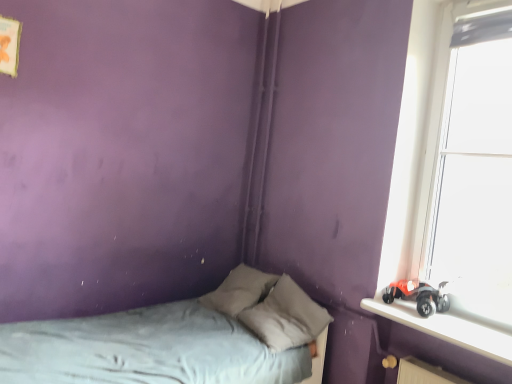
Describe the element at coordinates (458, 193) in the screenshot. I see `transparent glass window at right` at that location.

The height and width of the screenshot is (384, 512). I want to click on smooth plastic toy car at right, so click(x=446, y=328).

Is gray fabric pillow at center spatially inside gray fabric bed at lower left, or outside of it?

gray fabric pillow at center can be found inside gray fabric bed at lower left.

Is gray fabric pillow at center positioned far away from gray fabric bed at lower left?

gray fabric pillow at center is near gray fabric bed at lower left, not far away.

You are a GUI agent. You are given a task and a screenshot of the screen. Output one action in this format:
    pyautogui.click(x=<x>, y=<y>)
    Task: Click on the pillow on the right of the gray fabric bed at lower left
    This screenshot has width=512, height=384.
    Given the screenshot: What is the action you would take?
    pyautogui.click(x=286, y=317)

Is smooth plastic toy car at right inside gray fabric bed at lower left?

No, smooth plastic toy car at right is located outside of gray fabric bed at lower left.

Is gray fabric bed at lower left oriented away from smooth plastic toy car at right?

No.

The height and width of the screenshot is (384, 512). What are the coordinates of `window sill on the right side of gray fabric bed at lower left` in the screenshot? It's located at (446, 328).

Based on the photo, who is shorter, smooth plastic toy car at right or gray fabric bed at lower left?

With less height is smooth plastic toy car at right.

Does smooth plastic toy car at right contain gray fabric bed at lower left?

That's incorrect, gray fabric bed at lower left is not inside smooth plastic toy car at right.

Is smooth plastic toy car at right bigger or smaller than gray fabric bed at lower left?

Clearly, smooth plastic toy car at right is smaller in size than gray fabric bed at lower left.

Looking at the image, does gray fabric pillow at center seem bigger or smaller compared to transparent glass window at right?

In the image, gray fabric pillow at center appears to be smaller than transparent glass window at right.

Considering the points (319, 326) and (490, 116), which point is in front, point (319, 326) or point (490, 116)?

The point (490, 116) is in front.

Is gray fabric pillow at center aimed at transparent glass window at right?

No, gray fabric pillow at center does not turn towards transparent glass window at right.

Between smooth plastic toy car at right and transparent glass window at right, which one has less height?

Standing shorter between the two is smooth plastic toy car at right.

Identify the location of window sill on the left of transparent glass window at right. (446, 328).

What's the angular difference between smooth plastic toy car at right and transparent glass window at right's facing directions?

There is a 0.000233-degree angle between the facing directions of smooth plastic toy car at right and transparent glass window at right.

Considering the sizes of smooth plastic toy car at right and transparent glass window at right in the image, is smooth plastic toy car at right bigger or smaller than transparent glass window at right?

In the image, smooth plastic toy car at right appears to be smaller than transparent glass window at right.

Consider the image. Is transparent glass window at right next to gray fabric bed at lower left?

transparent glass window at right is not next to gray fabric bed at lower left, and they're not touching.

From the image's perspective, which is above, transparent glass window at right or gray fabric bed at lower left?

transparent glass window at right appears higher in the image.

Between transparent glass window at right and gray fabric bed at lower left, which one has larger size?

gray fabric bed at lower left.

Would you say transparent glass window at right is to the left or to the right of gray fabric bed at lower left in the picture?

From the image, it's evident that transparent glass window at right is to the right of gray fabric bed at lower left.

Is smooth plastic toy car at right to the right of gray fabric pillow at center from the viewer's perspective?

Correct, you'll find smooth plastic toy car at right to the right of gray fabric pillow at center.

The height and width of the screenshot is (384, 512). I want to click on pillow that appears below the smooth plastic toy car at right (from the image's perspective), so click(286, 317).

From a real-world perspective, is smooth plastic toy car at right below gray fabric pillow at center?

Incorrect, from a real-world perspective, smooth plastic toy car at right is higher than gray fabric pillow at center.

Which object is closer to the camera taking this photo, smooth plastic toy car at right or gray fabric pillow at center?

smooth plastic toy car at right is closer to the camera.

I want to click on pillow above the gray fabric bed at lower left (from a real-world perspective), so click(286, 317).

In the image, there is a smooth plastic toy car at right. At what (x,y) coordinates should I click in order to perform the action: click on bed below it (from a real-world perspective). Please return your answer as a coordinate pair (x, y). This screenshot has height=384, width=512. Looking at the image, I should click on (177, 339).

Which object lies nearer to the anchor point smooth plastic toy car at right, gray fabric bed at lower left or transparent glass window at right?

transparent glass window at right lies closer to smooth plastic toy car at right than the other object.

Which object lies further to the anchor point smooth plastic toy car at right, gray fabric pillow at center or transparent glass window at right?

gray fabric pillow at center is positioned further to the anchor smooth plastic toy car at right.

Estimate the real-world distances between objects in this image. Which object is further from smooth plastic toy car at right, gray fabric pillow at center or gray fabric bed at lower left?

gray fabric bed at lower left.

Which object lies nearer to the anchor point gray fabric bed at lower left, smooth plastic toy car at right or transparent glass window at right?

The object closer to gray fabric bed at lower left is smooth plastic toy car at right.

Considering their positions, is smooth plastic toy car at right positioned further to gray fabric bed at lower left than gray fabric pillow at center?

smooth plastic toy car at right is further to gray fabric bed at lower left.

When comparing their distances from transparent glass window at right, does smooth plastic toy car at right or gray fabric pillow at center seem further?

gray fabric pillow at center lies further to transparent glass window at right than the other object.

Considering their positions, is gray fabric bed at lower left positioned further to transparent glass window at right than gray fabric pillow at center?

Among the two, gray fabric bed at lower left is located further to transparent glass window at right.

Estimate the real-world distances between objects in this image. Which object is further from gray fabric bed at lower left, gray fabric pillow at center or transparent glass window at right?

transparent glass window at right is positioned further to the anchor gray fabric bed at lower left.

Where is `window sill between gray fabric bed at lower left and transparent glass window at right in the horizontal direction`? window sill between gray fabric bed at lower left and transparent glass window at right in the horizontal direction is located at coordinates (446, 328).

Where is `window sill between gray fabric pillow at center and transparent glass window at right from left to right`? This screenshot has height=384, width=512. window sill between gray fabric pillow at center and transparent glass window at right from left to right is located at coordinates (446, 328).

I want to click on pillow between gray fabric bed at lower left and transparent glass window at right from left to right, so click(286, 317).

Identify the location of pillow between gray fabric bed at lower left and smooth plastic toy car at right. The image size is (512, 384). (286, 317).